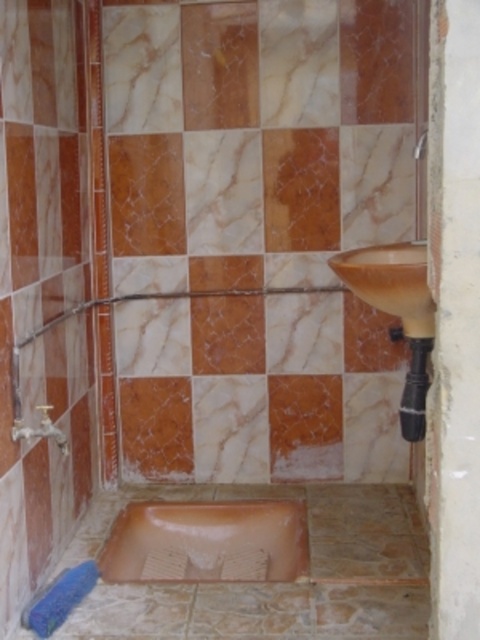
You are standing in the bathroom and see two points marked in the scene. Which point is closer to you, point (191,502) or point (420,252)?

Point (191,502) is further to the camera than point (420,252), so the point closer to you is point (420,252).